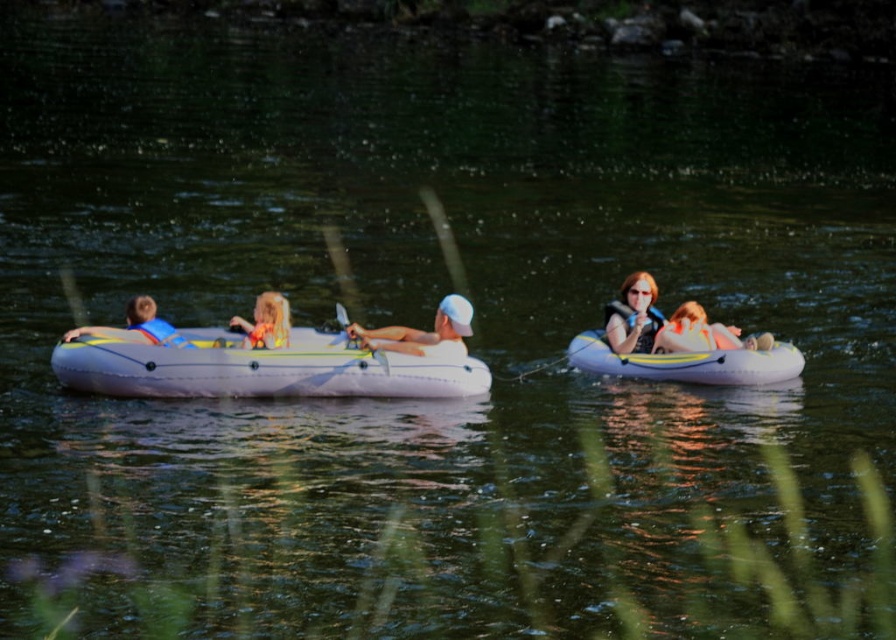
Question: Can you confirm if white rubber raft at center is positioned above matte yellow life vest at center?

Choices:
 (A) yes
 (B) no

Answer: (B)

Question: Considering the real-world distances, which object is closest to the matte black life vest at right?

Choices:
 (A) white matte life vest at center
 (B) matte blue life vest at left
 (C) white rubber raft at center
 (D) translucent yellow tube at center

Answer: (D)

Question: Does translucent yellow tube at center appear under white matte life vest at center?

Choices:
 (A) no
 (B) yes

Answer: (B)

Question: Which of the following is the farthest from the observer?

Choices:
 (A) (159, 336)
 (B) (246, 337)

Answer: (A)

Question: Among these points, which one is nearest to the camera?

Choices:
 (A) (255, 308)
 (B) (461, 337)
 (C) (649, 305)
 (D) (780, 364)

Answer: (A)

Question: Can you confirm if translucent yellow tube at center is bigger than wooden paddle at center?

Choices:
 (A) no
 (B) yes

Answer: (B)